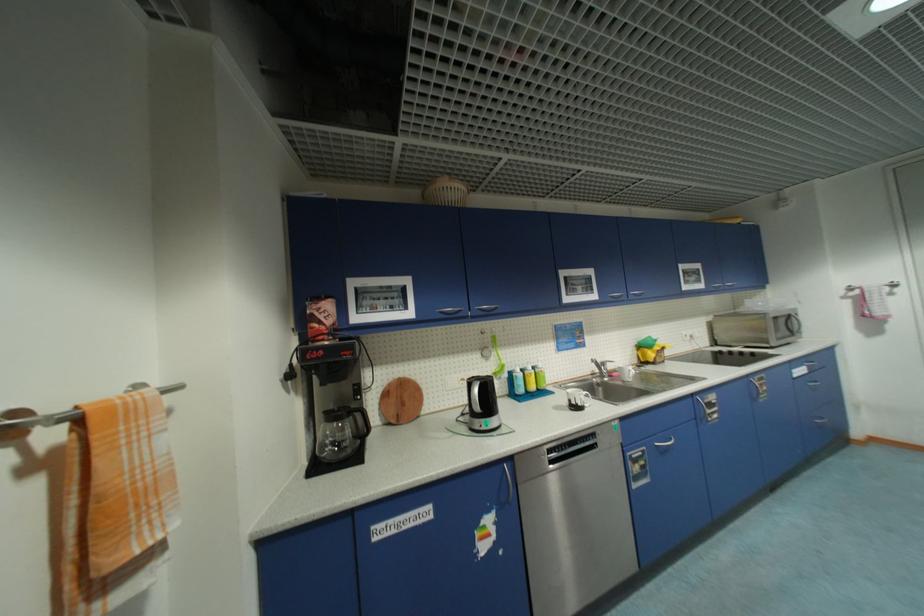
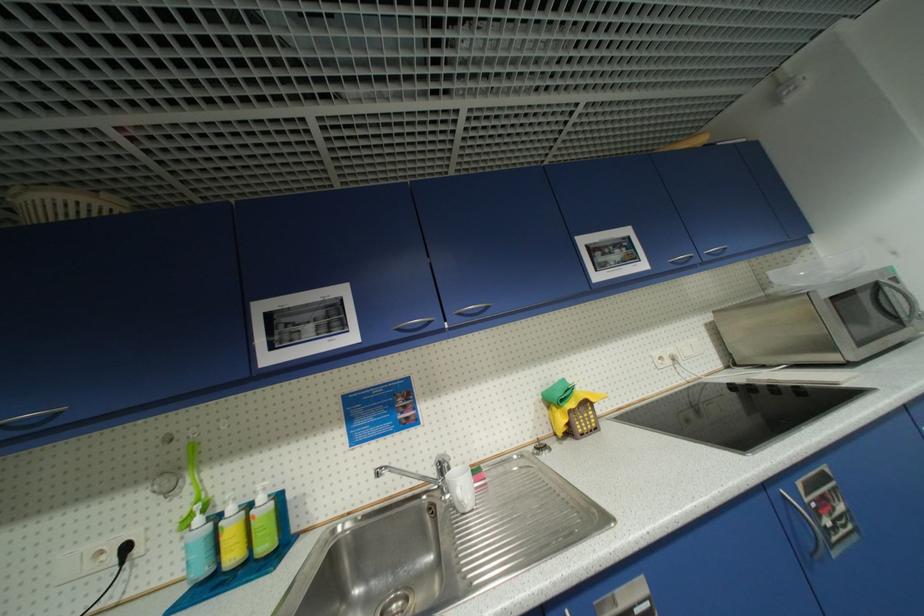
Find the pixel in the second image that matches [545,367] in the first image.

(266, 500)